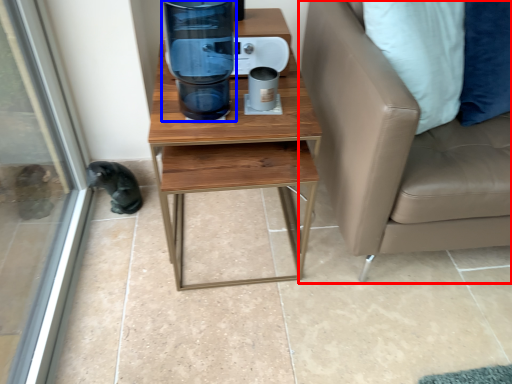
Question: Which of the following is the closest to the observer, studio couch (highlighted by a red box) or water cooler (highlighted by a blue box)?

Choices:
 (A) studio couch
 (B) water cooler

Answer: (A)